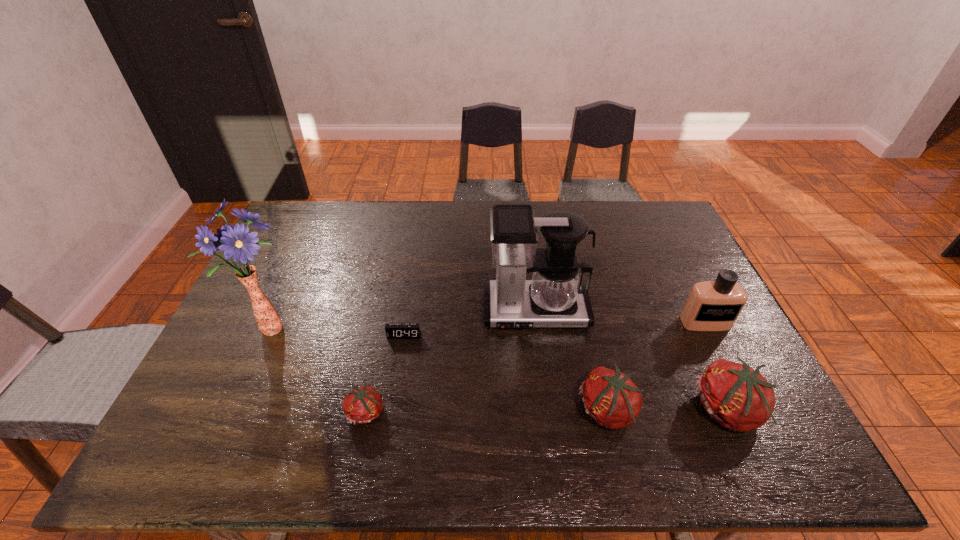
The width and height of the screenshot is (960, 540). Identify the location of free space between the third shortest object and the leftmost tomato. (488, 411).

Locate an element on the screen. This screenshot has width=960, height=540. vacant space in between the alarm clock and the fifth shortest object is located at coordinates [x=555, y=329].

Image resolution: width=960 pixels, height=540 pixels. I want to click on free point between the alarm clock and the leftmost tomato, so click(386, 374).

Find the location of a particular element. The image size is (960, 540). free point between the alarm clock and the coffee maker is located at coordinates (469, 323).

Where is `free space between the shortest object and the rightmost tomato`? The height and width of the screenshot is (540, 960). free space between the shortest object and the rightmost tomato is located at coordinates (565, 373).

You are a GUI agent. You are given a task and a screenshot of the screen. Output one action in this format:
    pyautogui.click(x=<x>, y=<y>)
    Task: Click on the object that is the fifth closest one to the perfume
    The width and height of the screenshot is (960, 540).
    Given the screenshot: What is the action you would take?
    pyautogui.click(x=363, y=404)

Locate an element on the screen. Image resolution: width=960 pixels, height=540 pixels. object that is the fourth closest to the second tomato from left to right is located at coordinates (393, 331).

The width and height of the screenshot is (960, 540). What are the coordinates of `tomato that stands as the closest to the second tomato from left to right` in the screenshot? It's located at (738, 397).

This screenshot has height=540, width=960. I want to click on tomato that is the third closest one to the perfume, so click(x=363, y=404).

Image resolution: width=960 pixels, height=540 pixels. Find the location of `free spot that satisfies the following two spatial constraints: 1. on the front-facing side of the rightmost tomato; 2. on the left side of the alarm clock`. free spot that satisfies the following two spatial constraints: 1. on the front-facing side of the rightmost tomato; 2. on the left side of the alarm clock is located at coordinates click(392, 410).